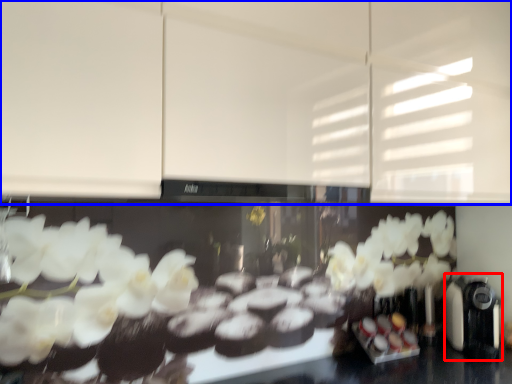
Question: Which object is closer to the camera taking this photo, coffee machine (highlighted by a red box) or cabinetry (highlighted by a blue box)?

Choices:
 (A) coffee machine
 (B) cabinetry

Answer: (B)